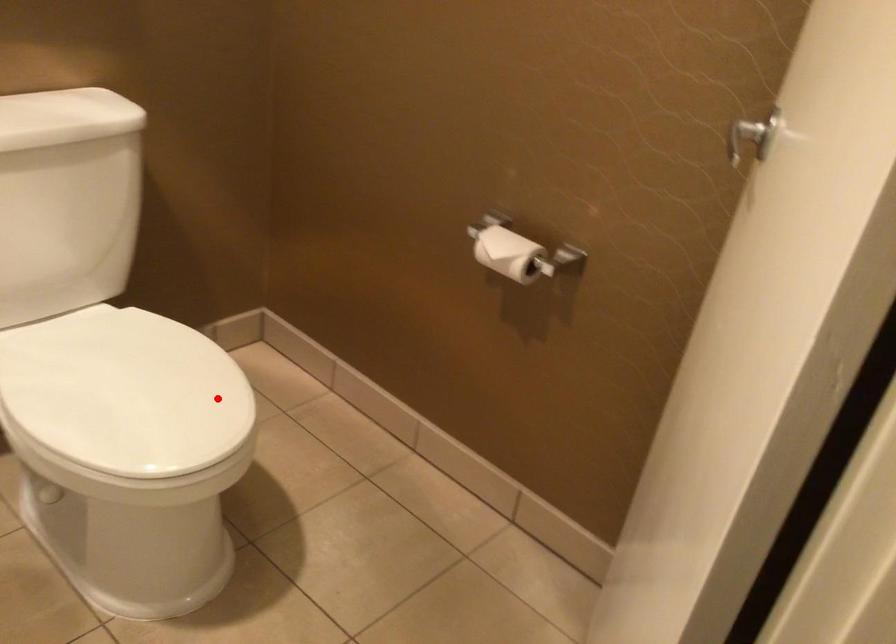
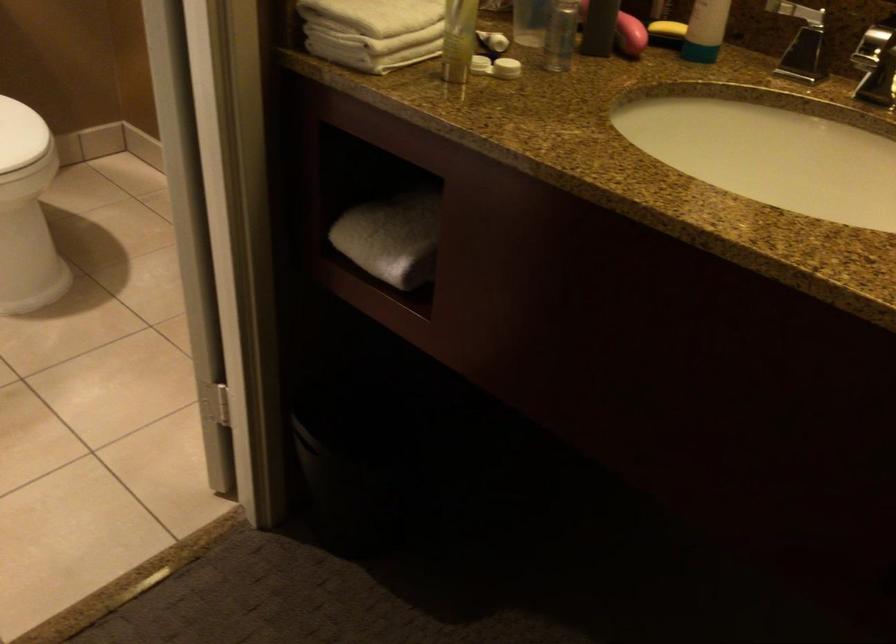
Question: I am providing you with two images of the same scene from different viewpoints. Image1 has a red point marked. In image2, the corresponding 3D location appears at what relative position? Reply with the corresponding letter.

Choices:
 (A) Closer
 (B) Farther

Answer: (B)